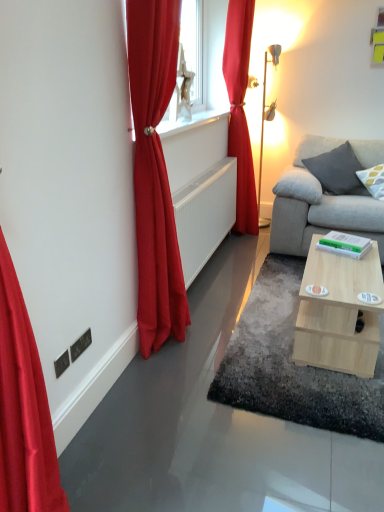
Measure the distance between point (131, 75) and camera.

Point (131, 75) is 6.13 feet from camera.

Image resolution: width=384 pixels, height=512 pixels. Describe the element at coordinates (266, 120) in the screenshot. I see `metallic gold table lamp at right` at that location.

Measure the distance between gray fabric pillow at right, positioned as the first pillow in right-to-left order, and camera.

3.28 meters.

This screenshot has height=512, width=384. Describe the element at coordinates (205, 215) in the screenshot. I see `white metallic radiator at center` at that location.

Find the location of a particular element. The height and width of the screenshot is (512, 384). satin red curtain at left, positioned as the 1th curtain in front-to-back order is located at coordinates pyautogui.click(x=155, y=172).

Looking at this image, could you tell me if metallic gold table lamp at right is turned towards light wood/texture coffee table at lower right?

No, metallic gold table lamp at right is not turned towards light wood/texture coffee table at lower right.

From the image's perspective, is metallic gold table lamp at right located above or below light wood/texture coffee table at lower right?

Clearly, from the image's perspective, metallic gold table lamp at right is above light wood/texture coffee table at lower right.

From a real-world perspective, which is physically below, metallic gold table lamp at right or light wood/texture coffee table at lower right?

In real-world perspective, light wood/texture coffee table at lower right is lower.

Could you measure the distance between metallic gold table lamp at right and light wood/texture coffee table at lower right?

metallic gold table lamp at right and light wood/texture coffee table at lower right are 7.46 feet apart from each other.

Between white metallic radiator at center and satin red curtain at upper right, the second curtain when ordered from left to right, which one has less height?

Standing shorter between the two is white metallic radiator at center.

Which of these two, white metallic radiator at center or satin red curtain at upper right, the 1th curtain from the right, is smaller?

white metallic radiator at center.

Is white metallic radiator at center oriented towards satin red curtain at upper right, the second curtain when ordered from left to right?

No, white metallic radiator at center does not turn towards satin red curtain at upper right, the second curtain when ordered from left to right.

What's the angular difference between white metallic radiator at center and satin red curtain at upper right, the 1th curtain from the right,'s facing directions?

1.96 degrees.

From the image's perspective, would you say satin red curtain at left, positioned as the 1th curtain in front-to-back order, is shown under metallic gold table lamp at right?

Yes.

Could you tell me if satin red curtain at left, which appears as the first curtain when viewed from the left, is turned towards metallic gold table lamp at right?

No, satin red curtain at left, which appears as the first curtain when viewed from the left, is not oriented towards metallic gold table lamp at right.

Is satin red curtain at left, which appears as the first curtain when viewed from the left, to the right of metallic gold table lamp at right from the viewer's perspective?

In fact, satin red curtain at left, which appears as the first curtain when viewed from the left, is to the left of metallic gold table lamp at right.

Is satin red curtain at left, which ranks as the second curtain in back-to-front order, thinner than metallic gold table lamp at right?

Yes.

Which is more to the right, satin red curtain at upper right, which is counted as the 1th curtain, starting from the back, or white metallic radiator at center?

satin red curtain at upper right, which is counted as the 1th curtain, starting from the back.

From a real-world perspective, is satin red curtain at upper right, the second curtain when ordered from left to right, positioned under white metallic radiator at center based on gravity?

No, from a real-world perspective, satin red curtain at upper right, the second curtain when ordered from left to right, is not beneath white metallic radiator at center.

Is satin red curtain at upper right, which is counted as the 1th curtain, starting from the back, surrounding white metallic radiator at center?

No, white metallic radiator at center is not inside satin red curtain at upper right, which is counted as the 1th curtain, starting from the back.

From the picture: Are satin red curtain at upper right, which is counted as the second curtain, starting from the front, and white metallic radiator at center beside each other?

satin red curtain at upper right, which is counted as the second curtain, starting from the front, and white metallic radiator at center are clearly separated.

Between light wood/texture coffee table at lower right and metallic gold table lamp at right, which one is positioned behind?

metallic gold table lamp at right is behind.

Which of these two, light wood/texture coffee table at lower right or metallic gold table lamp at right, is bigger?

With larger size is metallic gold table lamp at right.

Find the location of `table below the metallic gold table lamp at right (from the image's perspective)`. table below the metallic gold table lamp at right (from the image's perspective) is located at coordinates (339, 313).

How far apart are light wood/texture coffee table at lower right and metallic gold table lamp at right?

They are 7.46 feet apart.

Does point (235, 113) appear closer or farther from the camera than point (368, 176)?

Point (235, 113) appears to be farther away from the viewer than point (368, 176).

From the image's perspective, does satin red curtain at upper right, which is counted as the 1th curtain, starting from the back, appear higher than gray fabric pillow at right, positioned as the first pillow in right-to-left order?

Yes.

Who is taller, satin red curtain at upper right, the second curtain when ordered from left to right, or gray fabric pillow at right, the 2th pillow from the left?

With more height is satin red curtain at upper right, the second curtain when ordered from left to right.

Measure the distance from satin red curtain at upper right, which is counted as the 1th curtain, starting from the back, to gray fabric pillow at right, positioned as the first pillow in right-to-left order.

3.76 feet.

Considering the sizes of objects white metallic radiator at center and gray fabric pillow at right, the 2th pillow from the left, in the image provided, who is bigger, white metallic radiator at center or gray fabric pillow at right, the 2th pillow from the left,?

white metallic radiator at center.

From a real-world perspective, which is physically above, white metallic radiator at center or gray fabric pillow at right, the 2th pillow from the left?

From a 3D spatial view, gray fabric pillow at right, the 2th pillow from the left, is above.

Considering their positions, is white metallic radiator at center located in front of or behind gray fabric pillow at right, positioned as the first pillow in right-to-left order?

Visually, white metallic radiator at center is located in front of gray fabric pillow at right, positioned as the first pillow in right-to-left order.

This screenshot has height=512, width=384. I want to click on the 1st pillow behind when counting from the white metallic radiator at center, so click(373, 180).

Where is `table to the right of metallic gold table lamp at right`? The width and height of the screenshot is (384, 512). table to the right of metallic gold table lamp at right is located at coordinates (339, 313).

Locate an element on the screen. The image size is (384, 512). the 2nd curtain above when counting from the white metallic radiator at center (from the image's perspective) is located at coordinates (240, 110).

Considering their positions, is metallic gold table lamp at right positioned further to gray fabric pillow at right, the first pillow in the left-to-right sequence, than light wood/texture coffee table at lower right?

light wood/texture coffee table at lower right.

Which object lies further to the anchor point gray fabric pillow at right, the 2th pillow from the left, metallic gold table lamp at right or light wood/texture coffee table at lower right?

Based on the image, light wood/texture coffee table at lower right appears to be further to gray fabric pillow at right, the 2th pillow from the left.

Looking at the image, which one is located further to metallic gold table lamp at right, white metallic radiator at center or gray fabric pillow at right, the first pillow in the left-to-right sequence?

white metallic radiator at center is positioned further to the anchor metallic gold table lamp at right.

Looking at this image, considering their positions, is metallic gold table lamp at right positioned further to white metallic radiator at center than gray fabric pillow at right, the 2th pillow from the left?

The object further to white metallic radiator at center is gray fabric pillow at right, the 2th pillow from the left.

From the image, which object appears to be farther from light wood/texture coffee table at lower right, gray fabric pillow at right, the first pillow in the left-to-right sequence, or metallic gold table lamp at right?

Among the two, metallic gold table lamp at right is located further to light wood/texture coffee table at lower right.

From the image, which object appears to be nearer to metallic gold table lamp at right, white metallic radiator at center or satin red curtain at upper right, the 1th curtain from the right?

satin red curtain at upper right, the 1th curtain from the right, is closer to metallic gold table lamp at right.

Estimate the real-world distances between objects in this image. Which object is further from satin red curtain at left, which appears as the first curtain when viewed from the left, light wood/texture coffee table at lower right or gray fabric pillow at right, positioned as the first pillow in right-to-left order?

gray fabric pillow at right, positioned as the first pillow in right-to-left order, is positioned further to the anchor satin red curtain at left, which appears as the first curtain when viewed from the left.

From the image, which object appears to be nearer to gray fabric pillow at right, the 2th pillow from the left, satin red curtain at left, positioned as the 1th curtain in front-to-back order, or gray fabric pillow at right, the first pillow in the left-to-right sequence?

Among the two, gray fabric pillow at right, the first pillow in the left-to-right sequence, is located nearer to gray fabric pillow at right, the 2th pillow from the left.

In order to click on radiator between satin red curtain at left, which appears as the first curtain when viewed from the left, and gray fabric pillow at right, the 2th pillow from the left, in the horizontal direction in this screenshot , I will do `click(205, 215)`.

Where is `curtain located between white metallic radiator at center and metallic gold table lamp at right in the depth direction`? curtain located between white metallic radiator at center and metallic gold table lamp at right in the depth direction is located at coordinates (240, 110).

You are a GUI agent. You are given a task and a screenshot of the screen. Output one action in this format:
    pyautogui.click(x=<x>, y=<y>)
    Task: Click on the table between satin red curtain at left, positioned as the second curtain in right-to-left order, and satin red curtain at upper right, the 1th curtain from the right, along the z-axis
    The width and height of the screenshot is (384, 512).
    Given the screenshot: What is the action you would take?
    pyautogui.click(x=339, y=313)

Find the location of a particular element. The height and width of the screenshot is (512, 384). curtain between satin red curtain at left, positioned as the second curtain in right-to-left order, and gray fabric pillow at right, the 2th pillow from the left, from front to back is located at coordinates (240, 110).